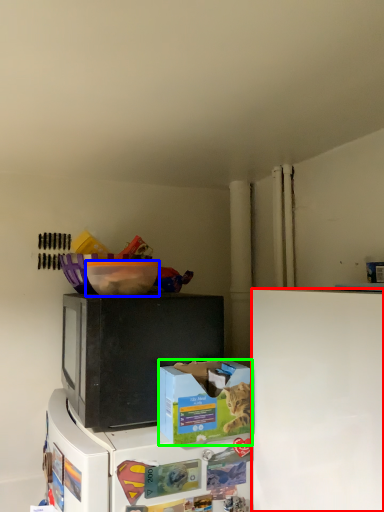
Question: Which object is positioned farthest from refrigerator (highlighted by a red box)? Select from bowl (highlighted by a blue box) and box (highlighted by a green box).

Choices:
 (A) bowl
 (B) box

Answer: (A)